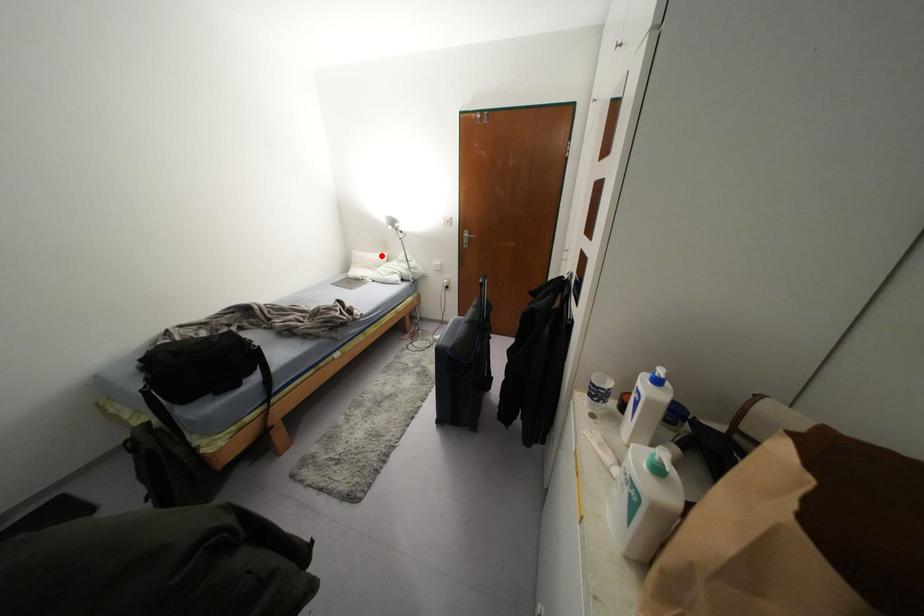
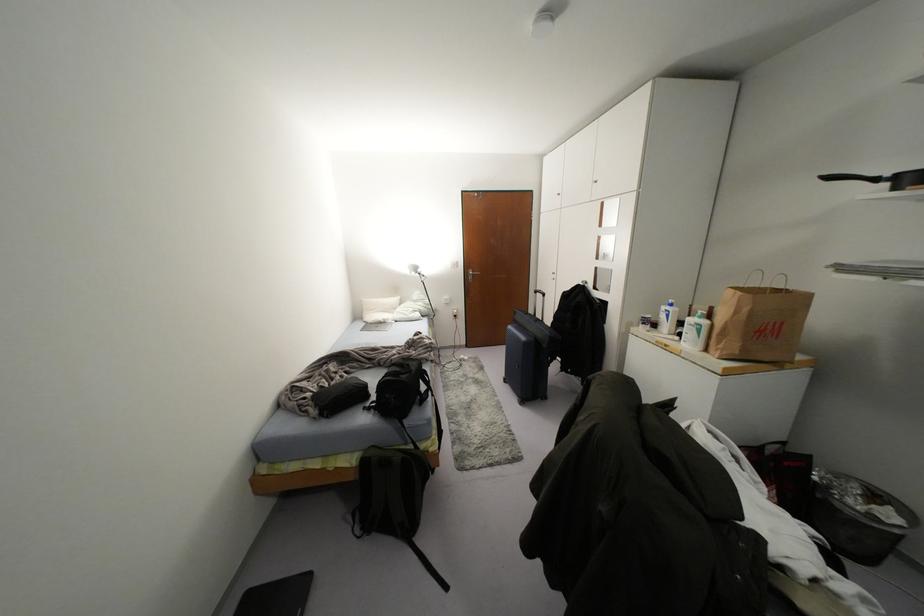
In the second image, find the point that corresponds to the highlighted location in the first image.

(394, 299)